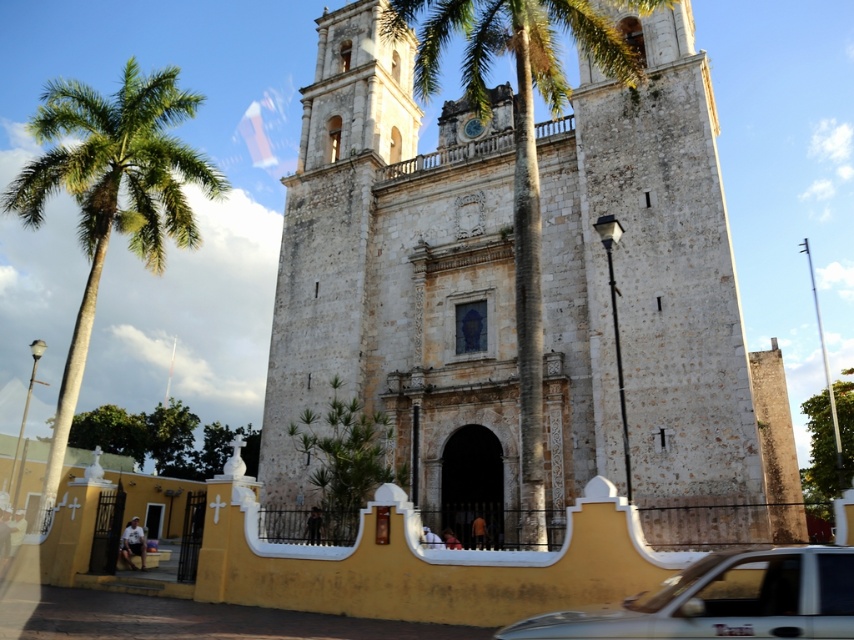
Who is more forward, (91, 163) or (434, 29)?

Positioned in front is point (434, 29).

Who is more forward, (34, 125) or (589, 49)?

Point (589, 49) is more forward.

This screenshot has height=640, width=854. What are the coordinates of `green leafy palm tree at left` in the screenshot? It's located at (110, 193).

What are the coordinates of `green leafy palm tree at center` in the screenshot? It's located at (518, 152).

Can you confirm if green leafy palm tree at center is positioned below white matte taxi at lower right?

No, green leafy palm tree at center is not below white matte taxi at lower right.

You are a GUI agent. You are given a task and a screenshot of the screen. Output one action in this format:
    pyautogui.click(x=<x>, y=<y>)
    Task: Click on the green leafy palm tree at center
    The height and width of the screenshot is (640, 854).
    Given the screenshot: What is the action you would take?
    pyautogui.click(x=518, y=152)

Based on the photo, how distant is green leafy palm tree at left from white matte taxi at lower right?

The distance of green leafy palm tree at left from white matte taxi at lower right is 54.82 meters.

Between green leafy palm tree at left and white matte taxi at lower right, which one has more height?

Standing taller between the two is green leafy palm tree at left.

Which is behind, point (185, 154) or point (817, 577)?

Positioned behind is point (185, 154).

Find the location of a particular element. The width and height of the screenshot is (854, 640). green leafy palm tree at left is located at coordinates 110,193.